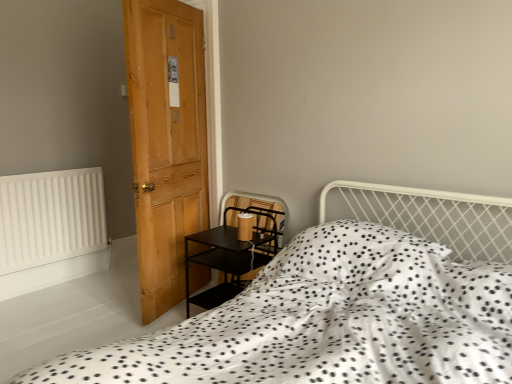
Question: Considering the positions of light brown wooden door at left and black matte side table at lower left in the image, is light brown wooden door at left taller or shorter than black matte side table at lower left?

Choices:
 (A) short
 (B) tall

Answer: (B)

Question: Is light brown wooden door at left situated inside black matte side table at lower left or outside?

Choices:
 (A) inside
 (B) outside

Answer: (B)

Question: Which object is positioned farthest from the black matte side table at lower left?

Choices:
 (A) light brown wooden door at left
 (B) white dotted fabric at center
 (C) white matte radiator at left

Answer: (C)

Question: Estimate the real-world distances between objects in this image. Which object is farther from the white matte radiator at left?

Choices:
 (A) white dotted fabric at center
 (B) black matte side table at lower left
 (C) light brown wooden door at left

Answer: (A)